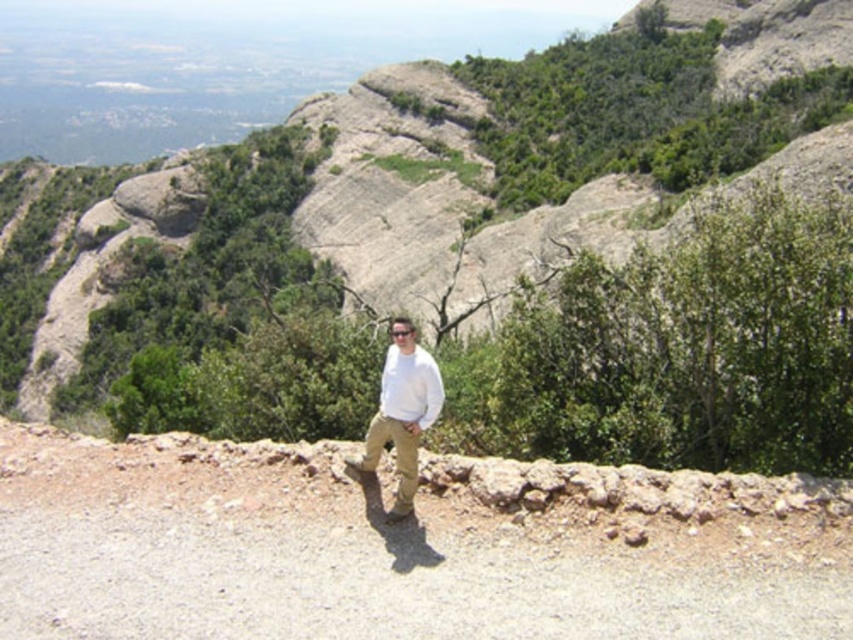
Looking at this image, you are a hiker trying to navigate between two points marked in the image. The first point is at coordinates point (x=109, y=307) and the second point is at point (x=421, y=387). Which point is further away from you if you are standing at the starting point of the dirt path?

Point (x=109, y=307) is behind point (x=421, y=387), so if you are standing at the starting point of the dirt path, point (x=109, y=307) is further away from you.

You are a hiker trying to estimate distances in the rugged landscape. You see the gray rock formation at center and the white cotton shirt at center. How far apart are these two landmarks?

The gray rock formation at center is 348.33 feet from the white cotton shirt at center.

You are a photographer trying to capture a landscape photo. You want to ensure that the gray rock formation at center and the white cotton shirt at center are both in the frame. Which object should you adjust your camera angle to prioritize capturing first, considering their sizes?

The gray rock formation at center is wider than the white cotton shirt at center, so you should prioritize capturing the gray rock formation at center first to ensure it fits properly in the frame.